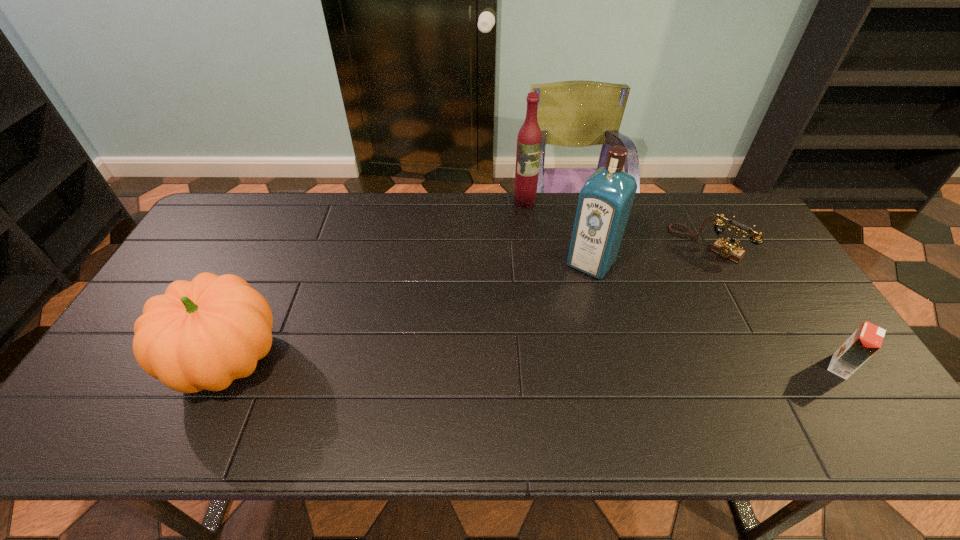
This screenshot has height=540, width=960. I want to click on vacant space at the near edge of the desktop, so click(567, 384).

The image size is (960, 540). In the image, there is a desktop. In order to click on vacant space at the far left corner in this screenshot , I will do `click(261, 201)`.

Identify the location of vacant space that's between the third object from right to left and the fourth object from right to left. The width and height of the screenshot is (960, 540). (558, 232).

Image resolution: width=960 pixels, height=540 pixels. In order to click on empty space that is in between the third tallest object and the second object from left to right in this screenshot , I will do `click(376, 281)`.

Where is `vacant region between the pumpkin and the fourth object from left to right`? The image size is (960, 540). vacant region between the pumpkin and the fourth object from left to right is located at coordinates (468, 302).

You are a GUI agent. You are given a task and a screenshot of the screen. Output one action in this format:
    pyautogui.click(x=<x>, y=<y>)
    Task: Click on the vacant region between the rightmost object and the nearer liquor
    Image resolution: width=960 pixels, height=540 pixels.
    Given the screenshot: What is the action you would take?
    pyautogui.click(x=715, y=315)

Image resolution: width=960 pixels, height=540 pixels. What are the coordinates of `free spot between the farther liquor and the rightmost object` in the screenshot? It's located at (683, 284).

You are a GUI agent. You are given a task and a screenshot of the screen. Output one action in this format:
    pyautogui.click(x=<x>, y=<y>)
    Task: Click on the vacant point located between the right liquor and the leftmost object
    This screenshot has width=960, height=540.
    Given the screenshot: What is the action you would take?
    pyautogui.click(x=410, y=312)

The width and height of the screenshot is (960, 540). I want to click on vacant space that is in between the rightmost object and the telephone, so click(774, 306).

This screenshot has width=960, height=540. What are the coordinates of `unoccupied area between the fourth object from left to right and the pumpkin` in the screenshot? It's located at (468, 302).